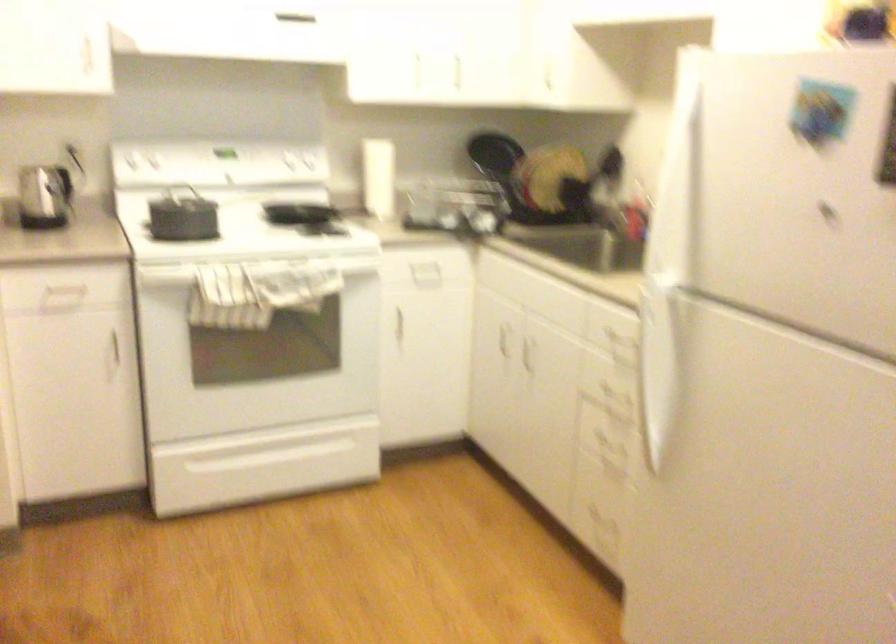
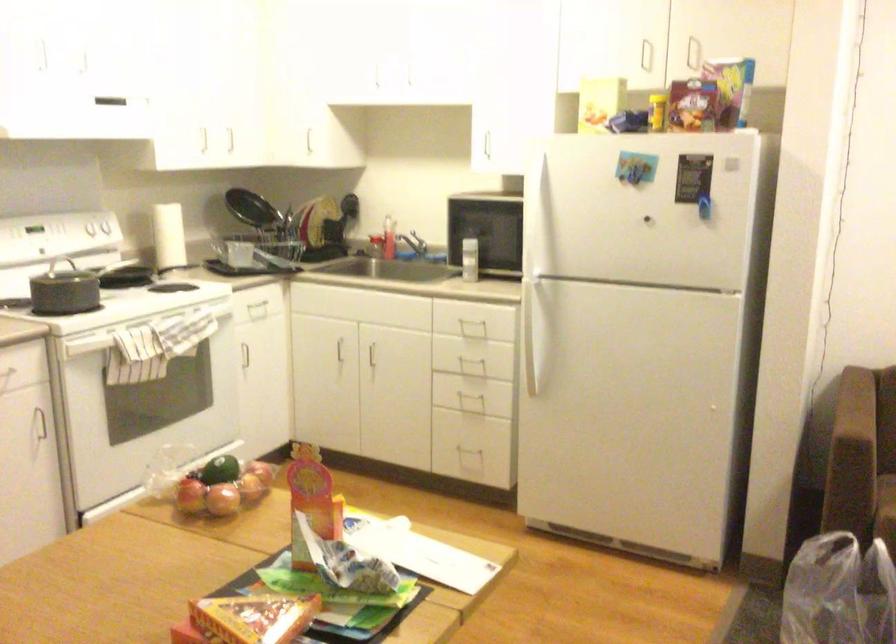
Question: I am providing you with two images of the same scene from different viewpoints. Please identify which objects are invisible in image2.

Choices:
 (A) kettle lid button
 (B) sofa armrest
 (C) white oven handle
 (D) sink faucet handle

Answer: (C)